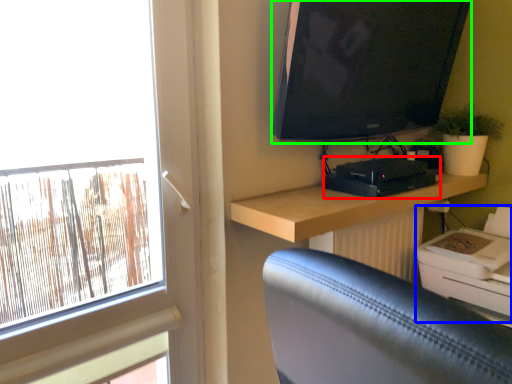
Question: Estimate the real-world distances between objects in this image. Which object is farther from equipment (highlighted by a red box), printer (highlighted by a blue box) or television (highlighted by a green box)?

Choices:
 (A) printer
 (B) television

Answer: (A)